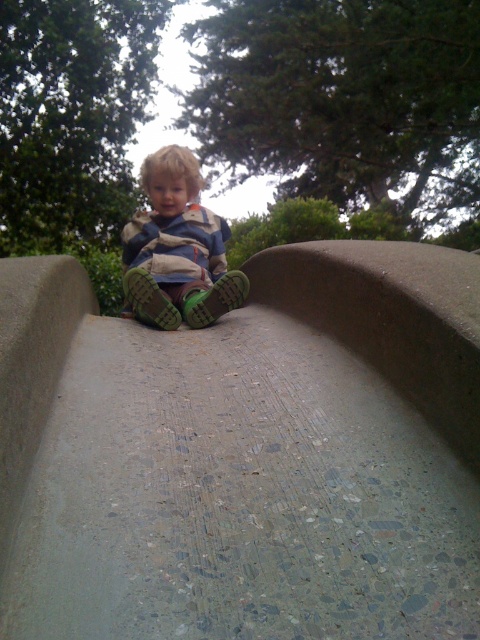
Can you confirm if gray concrete slide at center is positioned above matte green shoes at center?

No, gray concrete slide at center is not above matte green shoes at center.

Which is above, gray concrete slide at center or matte green shoes at center?

matte green shoes at center is above.

Find the location of a particular element. This screenshot has height=640, width=480. gray concrete slide at center is located at coordinates (266, 461).

Where is `gray concrete slide at center`? gray concrete slide at center is located at coordinates (266, 461).